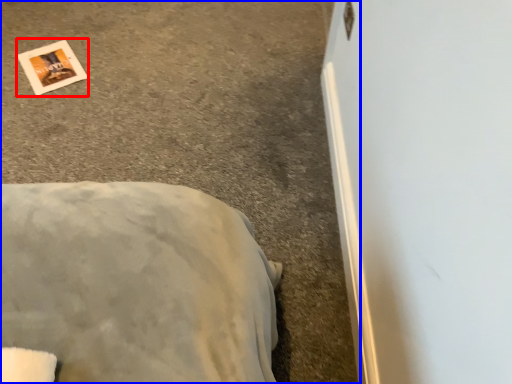
Question: Which object is closer to the camera taking this photo, postcard (highlighted by a red box) or concrete (highlighted by a blue box)?

Choices:
 (A) postcard
 (B) concrete

Answer: (B)